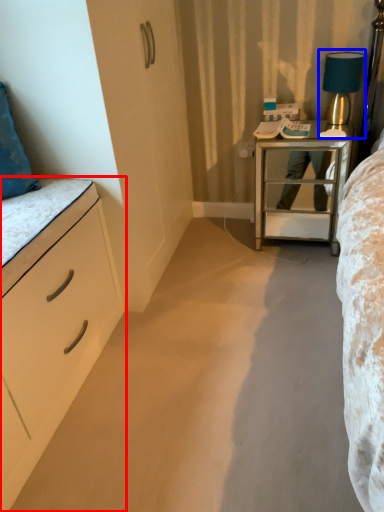
Question: Which of the following is the closest to the observer, chest of drawers (highlighted by a red box) or bedside lamp (highlighted by a blue box)?

Choices:
 (A) chest of drawers
 (B) bedside lamp

Answer: (A)